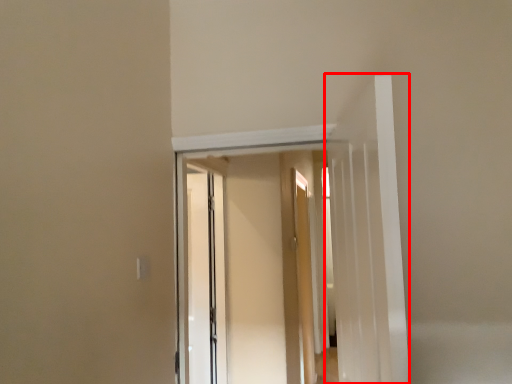
Question: From the image's perspective, where is door (annotated by the red box) located relative to screen door?

Choices:
 (A) below
 (B) above

Answer: (B)